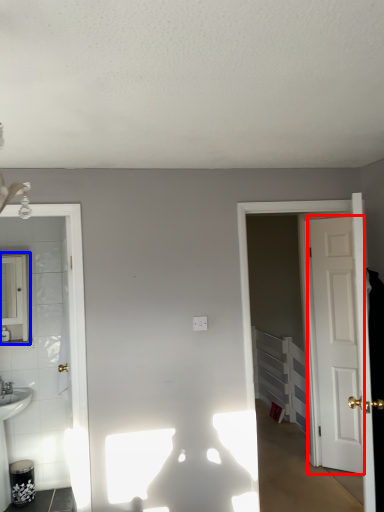
Question: Which point is further to the camera, door (highlighted by a red box) or mirror (highlighted by a blue box)?

Choices:
 (A) door
 (B) mirror

Answer: (A)